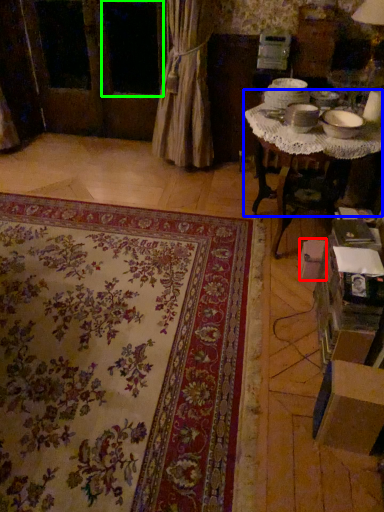
Question: Considering the real-world distances, which object is farthest from cardboard box (highlighted by a red box)? table (highlighted by a blue box) or window (highlighted by a green box)?

Choices:
 (A) table
 (B) window

Answer: (B)